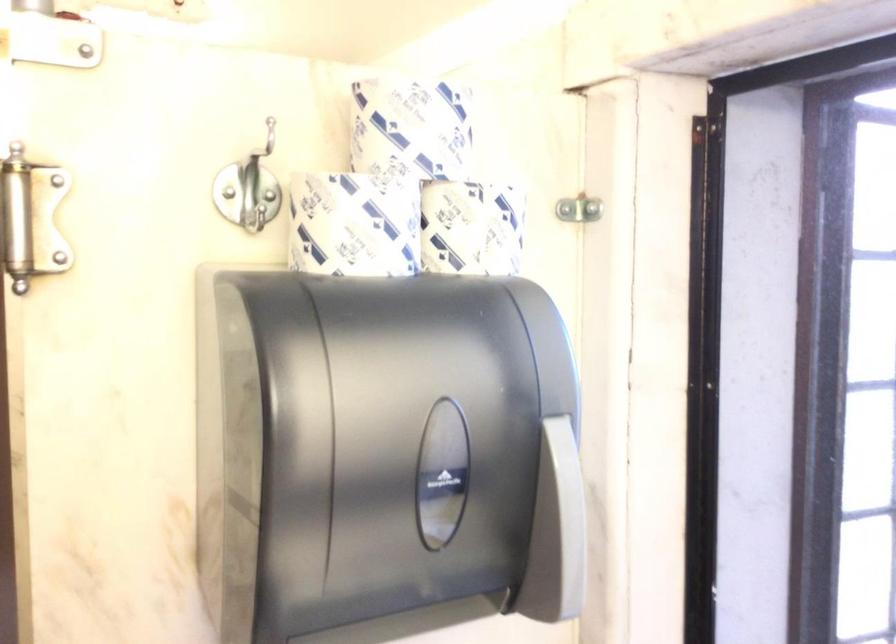
What do you see at coordinates (248, 187) in the screenshot?
I see `the metal coat hook` at bounding box center [248, 187].